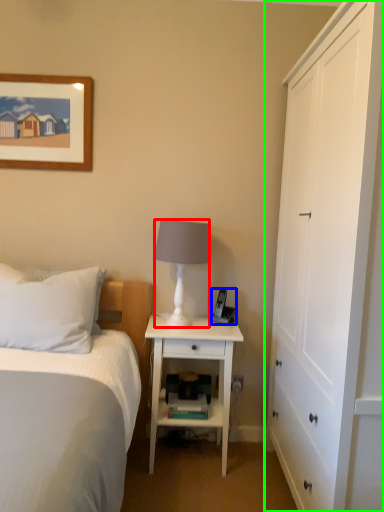
Question: Which is farther away from lamp (highlighted by a red box)? corded phone (highlighted by a blue box) or cabinetry (highlighted by a green box)?

Choices:
 (A) corded phone
 (B) cabinetry

Answer: (B)